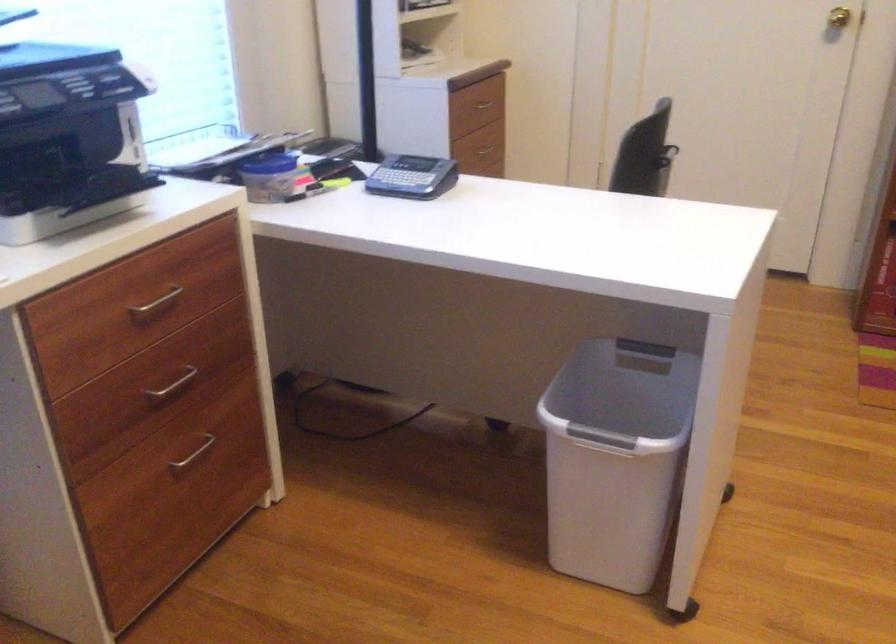
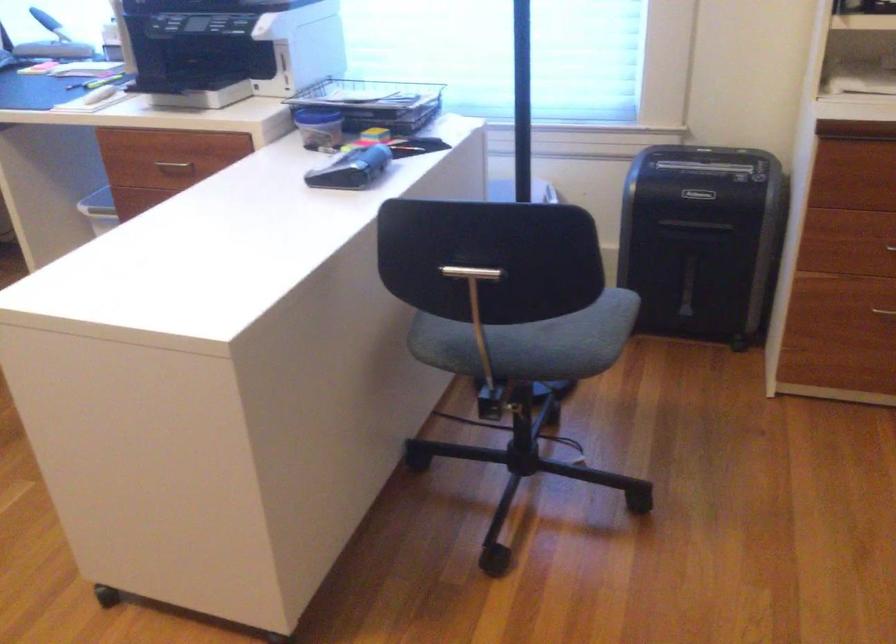
In the second image, find the point that corresponds to [436,176] in the first image.

(351, 169)